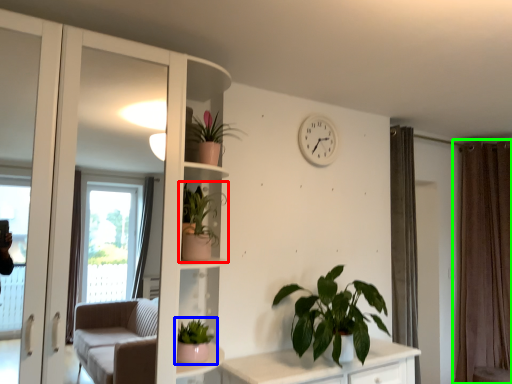
Question: Considering the real-world distances, which object is closest to houseplant (highlighted by a red box)? houseplant (highlighted by a blue box) or curtain (highlighted by a green box).

Choices:
 (A) houseplant
 (B) curtain

Answer: (A)